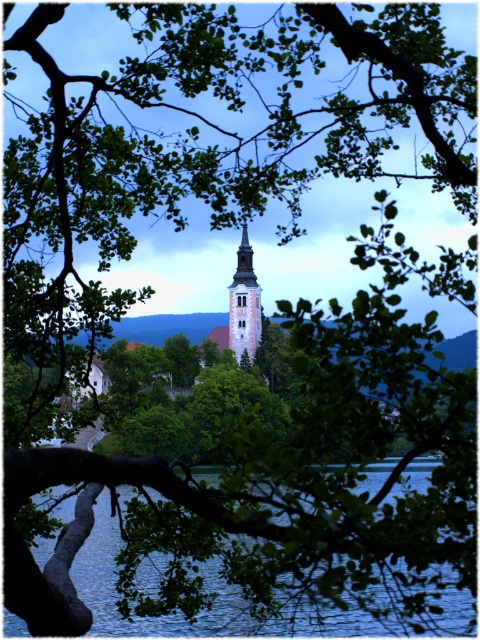
Which is below, blue water at lower center or smooth glass spire at center?

blue water at lower center

Between point (418, 477) and point (237, 339), which one is positioned behind?

The point (237, 339) is behind.

You are a GUI agent. You are given a task and a screenshot of the screen. Output one action in this format:
    pyautogui.click(x=<x>, y=<y>)
    Task: Click on the blue water at lower center
    The image size is (480, 640).
    Given the screenshot: What is the action you would take?
    pyautogui.click(x=213, y=604)